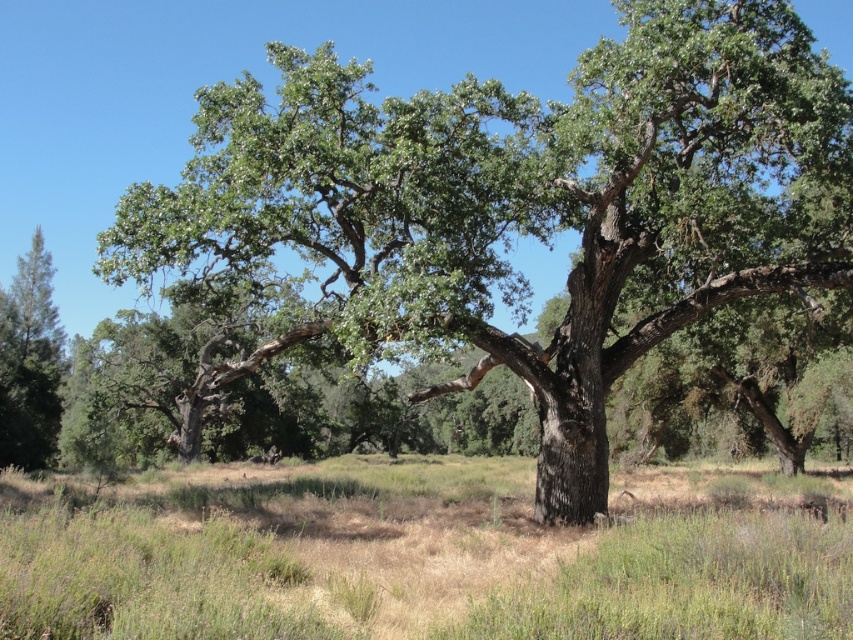
You are planning to plant a new tree in your backyard. The space you have is only suitable for plants that are smaller than the green grass at center. Can the green rough bark tree at center be planted there?

The green rough bark tree at center has a larger size compared to green grass at center, so it cannot be planted in the space since it exceeds the size requirement.

You are standing in the middle of the landscape and see the green rough bark tree at center and the green grass at center. Which object is positioned higher relative to the other?

The green rough bark tree at center is positioned above the green grass at center.

You are standing at the origin point of the coordinate system in the image. The green rough bark tree at center is located at point 0.319, 0.617. If you want to walk directly towards the tree, which direction should you head?

To walk directly towards the green rough bark tree at center located at coordinates (x=525, y=204) from the origin, you should head northeast since the tree is positioned in the northeast quadrant of the coordinate system.